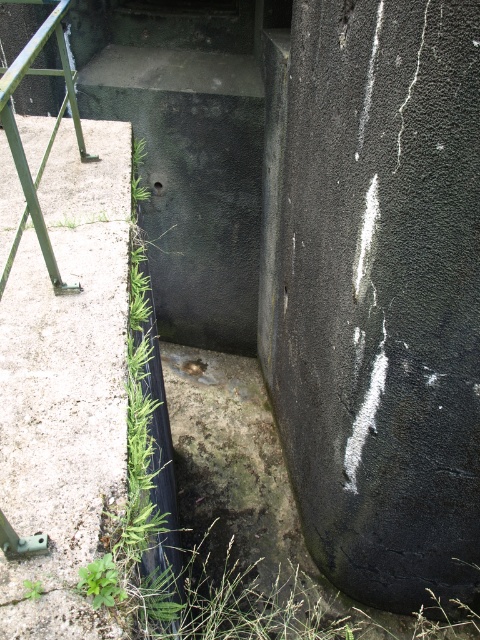
You are a maintenance worker assessing the structural integrity of the gray concrete at left and the green leafy weed at lower left. Which object is taller?

The gray concrete at left is taller than the green leafy weed at lower left according to the description.

You are a maintenance worker inspecting the concrete structure. You notice the green metal rail at left and the green leafy weed at lower left. Which object is positioned higher from the ground?

The green metal rail at left is above the green leafy weed at lower left, so the green metal rail at left is higher from the ground.